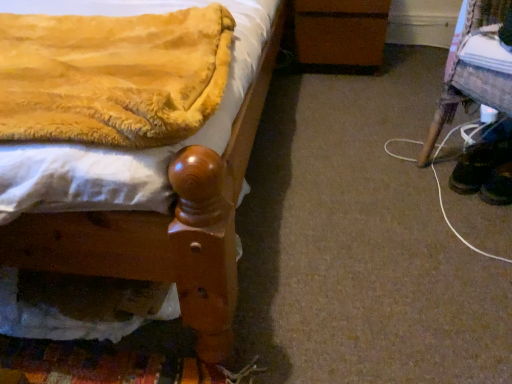
In order to face brown wooden changing table at center, should I rotate leftwards or rightwards?

To align with it, rotate right about 10.958°.

What do you see at coordinates (470, 71) in the screenshot? Image resolution: width=512 pixels, height=384 pixels. I see `wooden stool at lower right` at bounding box center [470, 71].

What do you see at coordinates (482, 157) in the screenshot?
I see `black leather shoes at lower right, which ranks as the first footwear in left-to-right order` at bounding box center [482, 157].

Image resolution: width=512 pixels, height=384 pixels. I want to click on velvet yellow blanket at upper left, so click(112, 76).

What do you see at coordinates (498, 186) in the screenshot?
I see `black suede shoes at lower right, the first footwear when ordered from right to left` at bounding box center [498, 186].

I want to click on brown wooden changing table at center, so click(341, 31).

Is wooden stool at lower right positioned with its back to wooden bedpost at left?

wooden stool at lower right is not turned away from wooden bedpost at left.

Locate an element on the screen. bed located in front of the wooden stool at lower right is located at coordinates (164, 229).

Measure the distance between wooden stool at lower right and wooden bedpost at left.

73.48 centimeters.

Considering the sizes of objects wooden stool at lower right and wooden bedpost at left in the image provided, who is shorter, wooden stool at lower right or wooden bedpost at left?

Standing shorter between the two is wooden stool at lower right.

From the image's perspective, between velvet yellow blanket at upper left and wooden stool at lower right, who is located below?

velvet yellow blanket at upper left is shown below in the image.

Considering the positions of points (185, 79) and (457, 103), is point (185, 79) farther from camera compared to point (457, 103)?

No, (185, 79) is closer to viewer.

Locate an element on the screen. Image resolution: width=512 pixels, height=384 pixels. blanket that is below the wooden stool at lower right (from the image's perspective) is located at coordinates (112, 76).

From the picture: From a real-world perspective, is velvet yellow blanket at upper left physically below wooden stool at lower right?

No, from a real-world perspective, velvet yellow blanket at upper left is not below wooden stool at lower right.

Is black suede shoes at lower right, the first footwear when ordered from right to left, closer to camera compared to black leather shoes at lower right, acting as the 2th footwear starting from the right?

Yes, it is in front of black leather shoes at lower right, acting as the 2th footwear starting from the right.

Considering the positions of objects black suede shoes at lower right, which is the 2th footwear in left-to-right order, and black leather shoes at lower right, acting as the 2th footwear starting from the right, in the image provided, who is more to the right, black suede shoes at lower right, which is the 2th footwear in left-to-right order, or black leather shoes at lower right, acting as the 2th footwear starting from the right,?

black suede shoes at lower right, which is the 2th footwear in left-to-right order, is more to the right.

Considering the relative sizes of black suede shoes at lower right, which is the 2th footwear in left-to-right order, and black leather shoes at lower right, acting as the 2th footwear starting from the right, in the image provided, is black suede shoes at lower right, which is the 2th footwear in left-to-right order, thinner than black leather shoes at lower right, acting as the 2th footwear starting from the right,?

Correct, the width of black suede shoes at lower right, which is the 2th footwear in left-to-right order, is less than that of black leather shoes at lower right, acting as the 2th footwear starting from the right.

Is black leather shoes at lower right, which ranks as the first footwear in left-to-right order, inside black suede shoes at lower right, the first footwear when ordered from right to left?

Definitely not — black leather shoes at lower right, which ranks as the first footwear in left-to-right order, is not inside black suede shoes at lower right, the first footwear when ordered from right to left.

Which of these two, velvet yellow blanket at upper left or black leather shoes at lower right, which ranks as the first footwear in left-to-right order, is thinner?

black leather shoes at lower right, which ranks as the first footwear in left-to-right order.

Find the location of a particular element. The width and height of the screenshot is (512, 384). footwear that is the 1st object located below the velvet yellow blanket at upper left (from the image's perspective) is located at coordinates (482, 157).

From a real-world perspective, between velvet yellow blanket at upper left and black leather shoes at lower right, which ranks as the first footwear in left-to-right order, who is vertically lower?

In real-world perspective, black leather shoes at lower right, which ranks as the first footwear in left-to-right order, is lower.

In terms of height, does velvet yellow blanket at upper left look taller or shorter compared to black leather shoes at lower right, which ranks as the first footwear in left-to-right order?

Clearly, velvet yellow blanket at upper left is shorter compared to black leather shoes at lower right, which ranks as the first footwear in left-to-right order.

From the image's perspective, is black leather shoes at lower right, which ranks as the first footwear in left-to-right order, positioned above or below wooden stool at lower right?

Clearly, from the image's perspective, black leather shoes at lower right, which ranks as the first footwear in left-to-right order, is below wooden stool at lower right.

Looking at this image, can you confirm if black leather shoes at lower right, acting as the 2th footwear starting from the right, is wider than wooden stool at lower right?

No, black leather shoes at lower right, acting as the 2th footwear starting from the right, is not wider than wooden stool at lower right.

Does black leather shoes at lower right, acting as the 2th footwear starting from the right, turn towards wooden stool at lower right?

Yes, black leather shoes at lower right, acting as the 2th footwear starting from the right, faces towards wooden stool at lower right.

Does point (503, 160) appear closer or farther from the camera than point (477, 96)?

Point (503, 160) appears to be farther away from the viewer than point (477, 96).

Can you see black leather shoes at lower right, acting as the 2th footwear starting from the right, touching wooden bedpost at left?

There is a gap between black leather shoes at lower right, acting as the 2th footwear starting from the right, and wooden bedpost at left.

Does black leather shoes at lower right, which ranks as the first footwear in left-to-right order, appear on the right side of wooden bedpost at left?

Yes, black leather shoes at lower right, which ranks as the first footwear in left-to-right order, is to the right of wooden bedpost at left.

Is black leather shoes at lower right, which ranks as the first footwear in left-to-right order, smaller than wooden bedpost at left?

Yes, black leather shoes at lower right, which ranks as the first footwear in left-to-right order, is smaller than wooden bedpost at left.

From a real-world perspective, who is located higher, black leather shoes at lower right, acting as the 2th footwear starting from the right, or wooden bedpost at left?

wooden bedpost at left.

Which is in front, point (459, 167) or point (506, 178)?

Positioned in front is point (506, 178).

Would you consider black leather shoes at lower right, acting as the 2th footwear starting from the right, to be distant from black suede shoes at lower right, the first footwear when ordered from right to left?

No, black leather shoes at lower right, acting as the 2th footwear starting from the right, is in close proximity to black suede shoes at lower right, the first footwear when ordered from right to left.

Considering the relative positions of black leather shoes at lower right, acting as the 2th footwear starting from the right, and black suede shoes at lower right, which is the 2th footwear in left-to-right order, in the image provided, is black leather shoes at lower right, acting as the 2th footwear starting from the right, to the left or to the right of black suede shoes at lower right, which is the 2th footwear in left-to-right order,?

Based on their positions, black leather shoes at lower right, acting as the 2th footwear starting from the right, is located to the left of black suede shoes at lower right, which is the 2th footwear in left-to-right order.

Find the location of a particular element. The image size is (512, 384). bed to the left of wooden stool at lower right is located at coordinates (164, 229).

What are the coordinates of `blanket in front of the wooden stool at lower right` in the screenshot? It's located at 112,76.

Which object lies further to the anchor point velvet yellow blanket at upper left, wooden stool at lower right or wooden bedpost at left?

The object further to velvet yellow blanket at upper left is wooden stool at lower right.

Considering their positions, is velvet yellow blanket at upper left positioned closer to black leather shoes at lower right, which ranks as the first footwear in left-to-right order, than black suede shoes at lower right, which is the 2th footwear in left-to-right order?

black suede shoes at lower right, which is the 2th footwear in left-to-right order, is closer to black leather shoes at lower right, which ranks as the first footwear in left-to-right order.

Estimate the real-world distances between objects in this image. Which object is closer to wooden bedpost at left, black leather shoes at lower right, acting as the 2th footwear starting from the right, or velvet yellow blanket at upper left?

velvet yellow blanket at upper left.

Considering their positions, is brown wooden changing table at center positioned closer to black leather shoes at lower right, which ranks as the first footwear in left-to-right order, than velvet yellow blanket at upper left?

Among the two, brown wooden changing table at center is located nearer to black leather shoes at lower right, which ranks as the first footwear in left-to-right order.

Which object lies further to the anchor point black leather shoes at lower right, which ranks as the first footwear in left-to-right order, brown wooden changing table at center or wooden bedpost at left?

wooden bedpost at left lies further to black leather shoes at lower right, which ranks as the first footwear in left-to-right order, than the other object.

Looking at this image, when comparing their distances from wooden stool at lower right, does black leather shoes at lower right, acting as the 2th footwear starting from the right, or brown wooden changing table at center seem further?

Based on the image, brown wooden changing table at center appears to be further to wooden stool at lower right.

Based on their spatial positions, is wooden stool at lower right or brown wooden changing table at center closer to black leather shoes at lower right, acting as the 2th footwear starting from the right?

wooden stool at lower right.

Which object lies further to the anchor point velvet yellow blanket at upper left, wooden stool at lower right or black suede shoes at lower right, which is the 2th footwear in left-to-right order?

black suede shoes at lower right, which is the 2th footwear in left-to-right order, lies further to velvet yellow blanket at upper left than the other object.

Image resolution: width=512 pixels, height=384 pixels. Identify the location of changing table situated between wooden bedpost at left and black leather shoes at lower right, which ranks as the first footwear in left-to-right order, from left to right. (341, 31).

I want to click on furniture positioned between velvet yellow blanket at upper left and brown wooden changing table at center from near to far, so click(x=470, y=71).

In order to click on footwear between wooden bedpost at left and black suede shoes at lower right, the first footwear when ordered from right to left, from left to right in this screenshot , I will do `click(482, 157)`.

Locate an element on the screen. blanket situated between wooden bedpost at left and wooden stool at lower right from left to right is located at coordinates (112, 76).